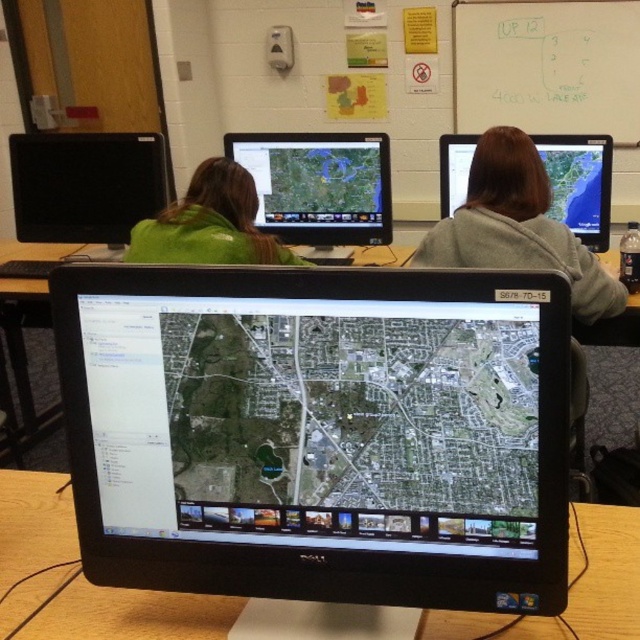
Looking at this image, in the classroom scene, you notice a Dell monitor in the center and a gray fleece jacket at upper right. What object is located at the coordinates point (516, 227)?

The gray fleece jacket at upper right is located at point (516, 227).

You are a student entering the classroom and need to sit between the gray fleece jacket at upper right and the green matte jacket at upper left. Which direction should you walk to ensure you are between them?

You should walk towards the center of the classroom between the gray fleece jacket at upper right and the green matte jacket at upper left since the gray fleece jacket at upper right is positioned to the right of the green matte jacket at upper left.

From the picture: You are a student in the classroom and need to click on one of the two points displayed on the Dell monitor in the center. Which point, point (454, 260) or point (248, 216), is closer to you on the monitor?

Point (454, 260) is closer to the viewer than point (248, 216) on the Dell monitor in the center.